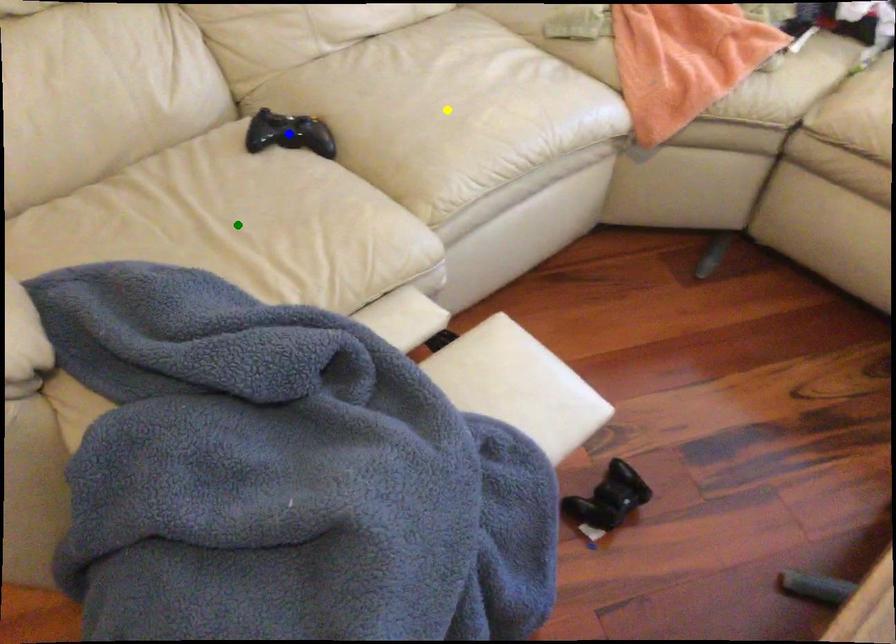
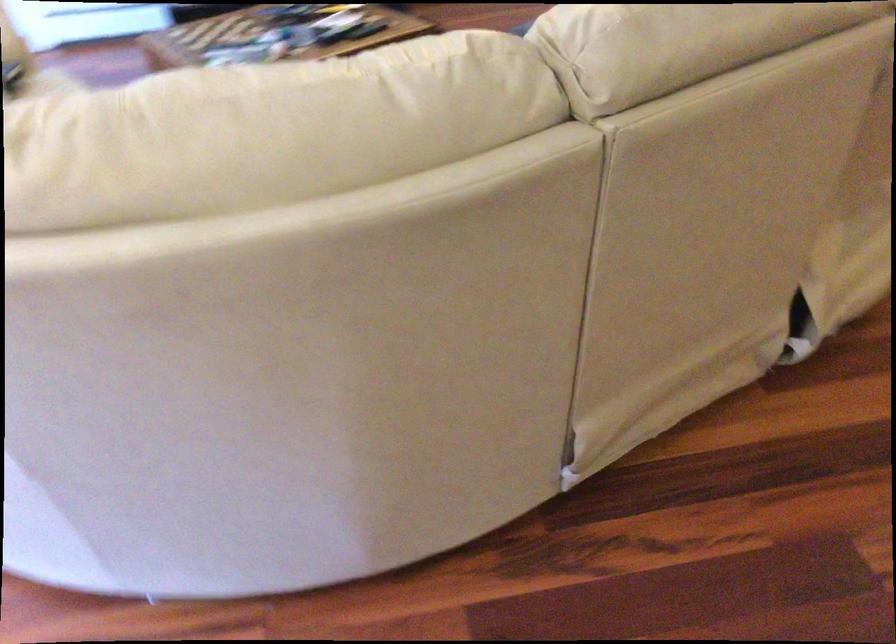
I am providing you with two images of the same scene from different viewpoints. Three points are marked in image1. Which point corresponds to a part or object that is occluded in image2?In image1, three points are marked. Which of them correspond to a part or object that is occluded in image2?Among the three points shown in image1, which one corresponds to a part or object that is no longer visible due to occlusion in image2?

Invisible in image2: yellow point, green point, blue point.